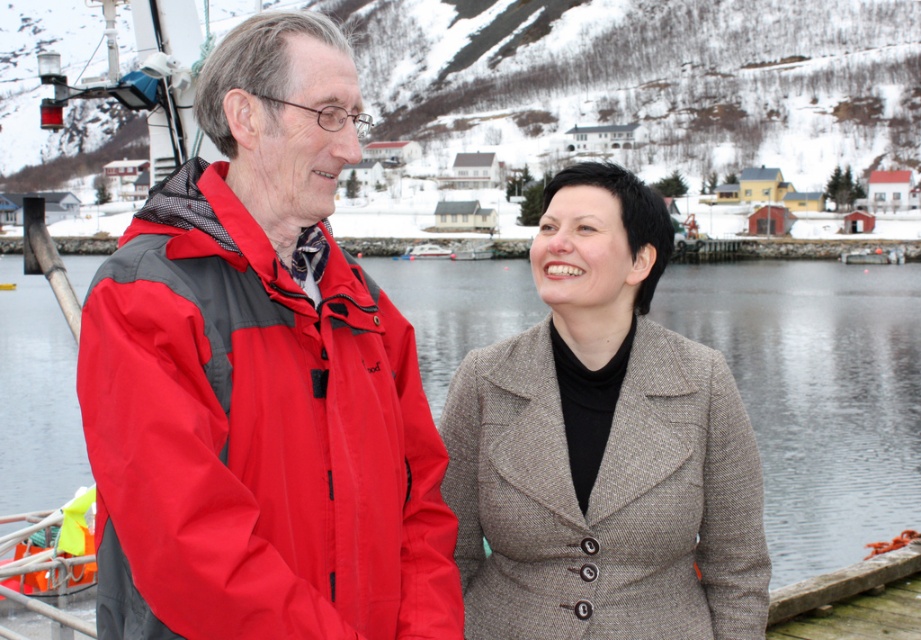
Does matte red jacket at left have a lesser width compared to brown woolen coat at center?

Correct, matte red jacket at left's width is less than brown woolen coat at center's.

Is matte red jacket at left smaller than brown woolen coat at center?

Actually, matte red jacket at left might be larger than brown woolen coat at center.

The image size is (921, 640). Find the location of `matte red jacket at left`. matte red jacket at left is located at coordinates (255, 436).

Find the location of `matte red jacket at left`. matte red jacket at left is located at coordinates (255, 436).